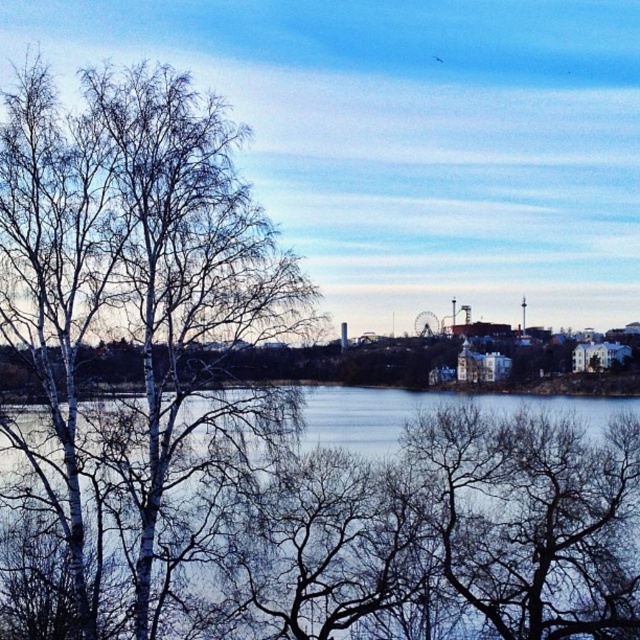
Question: Can you confirm if bare white tree at left is positioned below blue water at center?

Choices:
 (A) yes
 (B) no

Answer: (B)

Question: Among these objects, which one is nearest to the camera?

Choices:
 (A) blue water at center
 (B) bare white tree at left

Answer: (B)

Question: Among these objects, which one is farthest from the camera?

Choices:
 (A) blue water at center
 (B) bare white tree at left

Answer: (A)

Question: Is bare white tree at left positioned behind blue water at center?

Choices:
 (A) yes
 (B) no

Answer: (B)

Question: Can you confirm if bare white tree at left is smaller than blue water at center?

Choices:
 (A) yes
 (B) no

Answer: (A)

Question: Which object is closer to the camera taking this photo?

Choices:
 (A) blue water at center
 (B) bare white tree at left

Answer: (B)